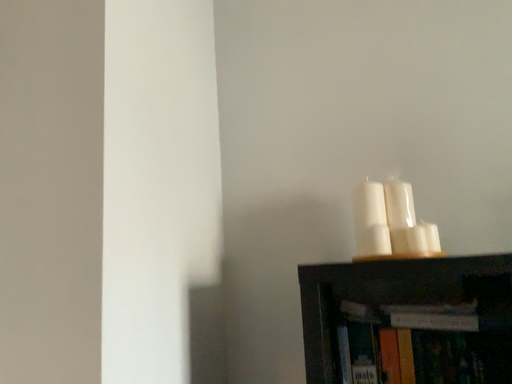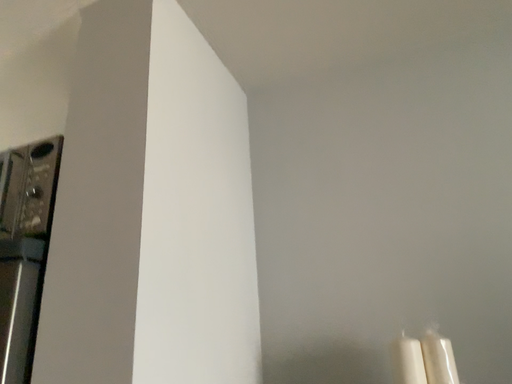
Question: Which way did the camera rotate in the video?

Choices:
 (A) rotated right
 (B) rotated left

Answer: (B)